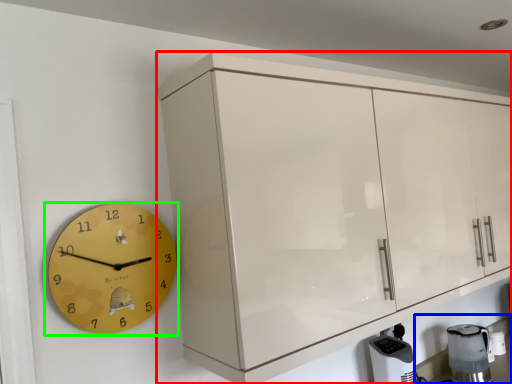
Question: Which object is the closest to the cabinetry (highlighted by a red box)? Choose among these: counter top (highlighted by a blue box) or wall clock (highlighted by a green box).

Choices:
 (A) counter top
 (B) wall clock

Answer: (B)